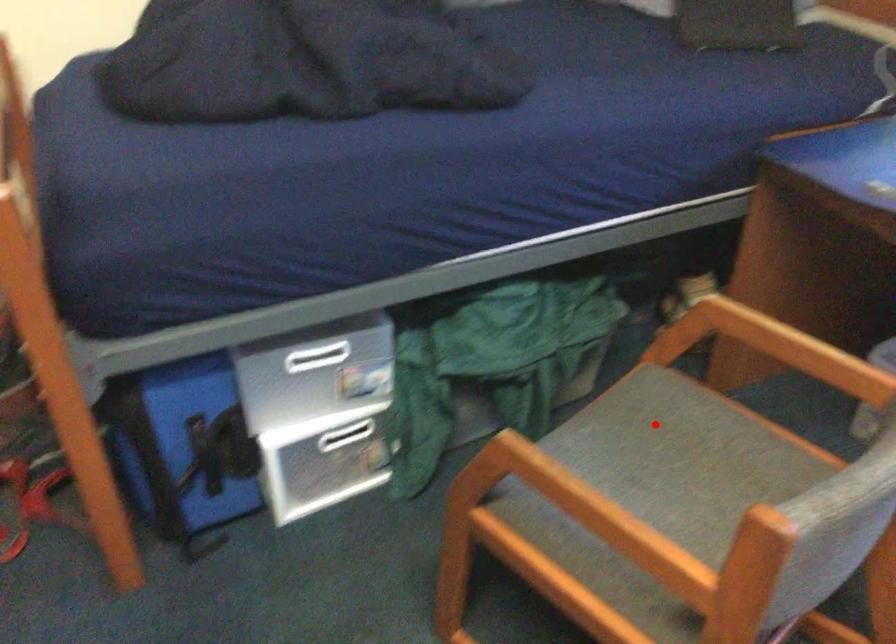
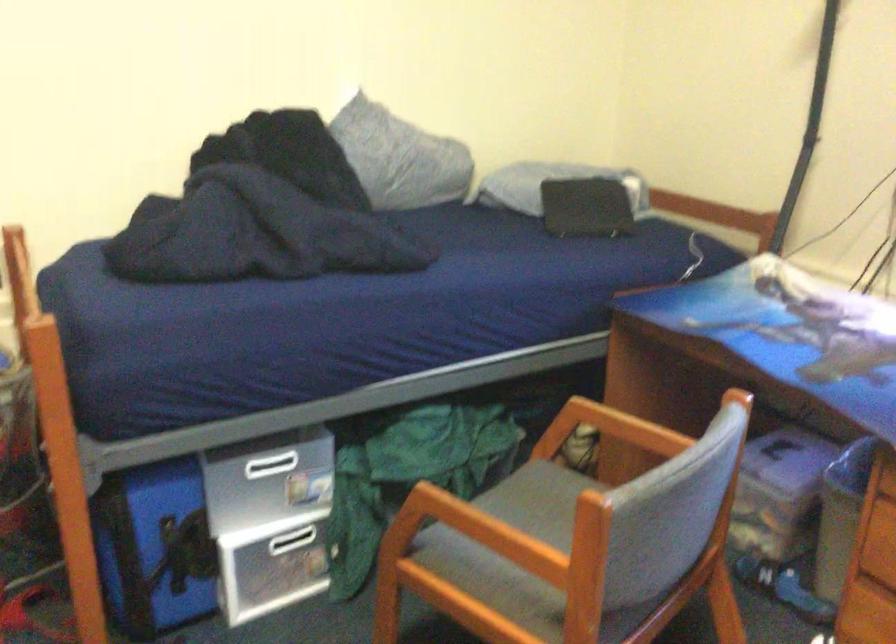
Question: I am providing you with two images of the same scene from different viewpoints. Given a red point in image1, look at the same physical point in image2. Is it:

Choices:
 (A) Closer to the viewpoint
 (B) Farther from the viewpoint

Answer: (B)